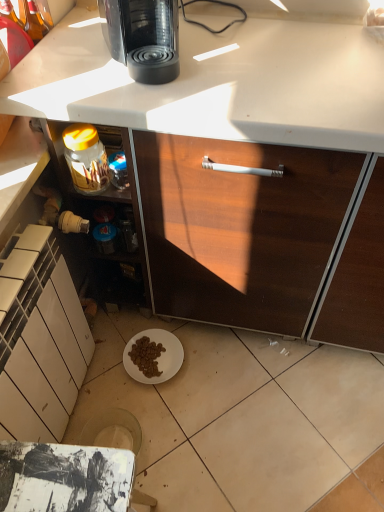
Question: Can you confirm if white matte cabinet at lower left is taller than black glossy coffee maker at upper center?

Choices:
 (A) no
 (B) yes

Answer: (B)

Question: Considering the relative positions of white matte cabinet at lower left and black glossy coffee maker at upper center in the image provided, is white matte cabinet at lower left to the right of black glossy coffee maker at upper center from the viewer's perspective?

Choices:
 (A) no
 (B) yes

Answer: (A)

Question: Is white matte cabinet at lower left aimed at black glossy coffee maker at upper center?

Choices:
 (A) no
 (B) yes

Answer: (A)

Question: From a real-world perspective, is white matte cabinet at lower left physically below black glossy coffee maker at upper center?

Choices:
 (A) no
 (B) yes

Answer: (B)

Question: Does white matte cabinet at lower left have a lesser width compared to black glossy coffee maker at upper center?

Choices:
 (A) no
 (B) yes

Answer: (B)

Question: Is black glossy coffee maker at upper center completely or partially inside white matte cabinet at lower left?

Choices:
 (A) yes
 (B) no

Answer: (B)

Question: Is black glossy coffee maker at upper center positioned beyond the bounds of white matte cabinet at lower left?

Choices:
 (A) yes
 (B) no

Answer: (A)

Question: Does black glossy coffee maker at upper center contain white matte cabinet at lower left?

Choices:
 (A) yes
 (B) no

Answer: (B)

Question: Does black glossy coffee maker at upper center lie in front of white matte cabinet at lower left?

Choices:
 (A) yes
 (B) no

Answer: (B)

Question: From a real-world perspective, is black glossy coffee maker at upper center located beneath white matte cabinet at lower left?

Choices:
 (A) no
 (B) yes

Answer: (A)

Question: Is black glossy coffee maker at upper center far from white matte cabinet at lower left?

Choices:
 (A) yes
 (B) no

Answer: (B)

Question: Can you confirm if black glossy coffee maker at upper center is bigger than white matte cabinet at lower left?

Choices:
 (A) yes
 (B) no

Answer: (B)

Question: Is translucent glass jar at lower left inside white matte cabinet at lower left?

Choices:
 (A) yes
 (B) no

Answer: (B)